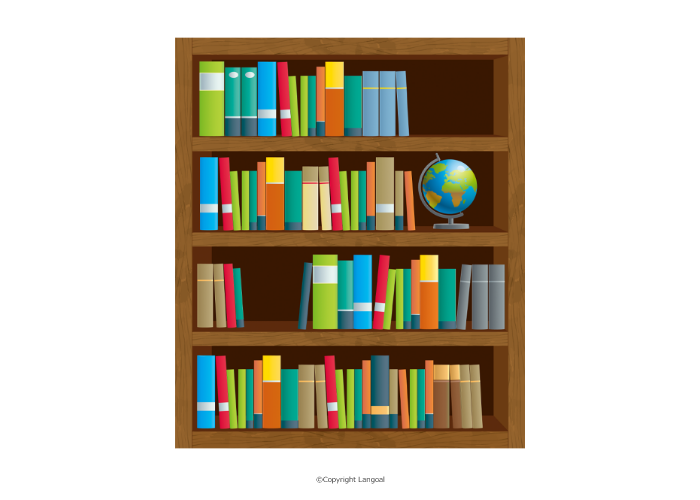
Find the location of a particular element. This screenshot has width=700, height=500. shelves below books is located at coordinates (328, 439), (332, 335), (332, 236), (336, 140).